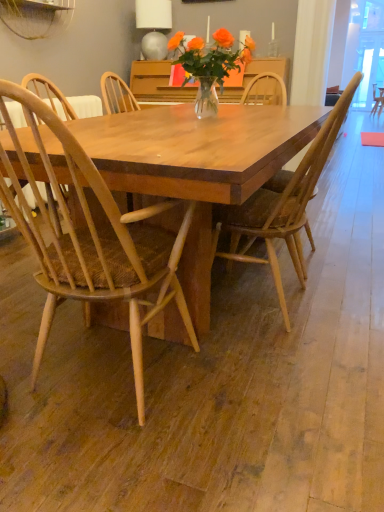
Locate an element on the screen. The width and height of the screenshot is (384, 512). matte gray lampshade at upper center is located at coordinates (154, 26).

Find the location of a particular element. Image resolution: width=384 pixels, height=512 pixels. matte gray lampshade at upper center is located at coordinates (154, 26).

Between matte gray lampshade at upper center and natural wood chair at center, which is the 1th chair in left-to-right order, which one has less height?

With less height is matte gray lampshade at upper center.

From a real-world perspective, is matte gray lampshade at upper center positioned above or below natural wood chair at center, which is the 1th chair in left-to-right order?

Clearly, from a real-world perspective, matte gray lampshade at upper center is above natural wood chair at center, which is the 1th chair in left-to-right order.

Considering the relative sizes of matte gray lampshade at upper center and natural wood chair at center, which is the 1th chair in left-to-right order, in the image provided, is matte gray lampshade at upper center thinner than natural wood chair at center, which is the 1th chair in left-to-right order,?

Indeed, matte gray lampshade at upper center has a lesser width compared to natural wood chair at center, which is the 1th chair in left-to-right order.

Is matte gray lampshade at upper center outside of wooden chair at center, the 2th chair in the left-to-right sequence?

Yes, matte gray lampshade at upper center is located beyond the bounds of wooden chair at center, the 2th chair in the left-to-right sequence.

From the image's perspective, which is below, matte gray lampshade at upper center or wooden chair at center, which is counted as the 1th chair, starting from the right?

wooden chair at center, which is counted as the 1th chair, starting from the right, is shown below in the image.

Which is farther from the camera, (148, 45) or (233, 218)?

Point (148, 45)

How distant is matte gray lampshade at upper center from wooden chair at center, the 2th chair in the left-to-right sequence?

The distance of matte gray lampshade at upper center from wooden chair at center, the 2th chair in the left-to-right sequence, is 8.66 feet.

From the picture: Is wooden chair at center, which is counted as the 1th chair, starting from the right, looking in the opposite direction of matte gray lampshade at upper center?

No.

Which point is more forward, (264,262) or (153,53)?

The point (264,262) is more forward.

Which of these two, wooden chair at center, which is counted as the 1th chair, starting from the right, or matte gray lampshade at upper center, is thinner?

matte gray lampshade at upper center is thinner.

Consider the image. Are wooden chair at center, the 2th chair in the left-to-right sequence, and matte gray lampshade at upper center far apart?

wooden chair at center, the 2th chair in the left-to-right sequence, is positioned a significant distance from matte gray lampshade at upper center.

Where is `chair behind the natural wood chair at center, which is the 1th chair in left-to-right order`? The height and width of the screenshot is (512, 384). chair behind the natural wood chair at center, which is the 1th chair in left-to-right order is located at coordinates (286, 205).

In terms of height, does natural wood chair at center, which is the 1th chair in left-to-right order, look taller or shorter compared to wooden chair at center, the 2th chair in the left-to-right sequence?

Clearly, natural wood chair at center, which is the 1th chair in left-to-right order, is taller compared to wooden chair at center, the 2th chair in the left-to-right sequence.

Is natural wood chair at center, which is the 1th chair in left-to-right order, positioned far away from wooden chair at center, the 2th chair in the left-to-right sequence?

natural wood chair at center, which is the 1th chair in left-to-right order, is actually quite close to wooden chair at center, the 2th chair in the left-to-right sequence.

Is natural wood chair at center, which is counted as the 2th chair, starting from the right, in front of or behind wooden chair at center, which is counted as the 1th chair, starting from the right, in the image?

Clearly, natural wood chair at center, which is counted as the 2th chair, starting from the right, is in front of wooden chair at center, which is counted as the 1th chair, starting from the right.

Which is more to the right, natural wood chair at center, which is the 1th chair in left-to-right order, or matte gray lampshade at upper center?

From the viewer's perspective, natural wood chair at center, which is the 1th chair in left-to-right order, appears more on the right side.

This screenshot has width=384, height=512. Identify the location of lamp lying behind the natural wood chair at center, which is the 1th chair in left-to-right order. (154, 26).

Is natural wood chair at center, which is counted as the 2th chair, starting from the right, positioned in front of matte gray lampshade at upper center?

That is True.

Who is shorter, natural wood chair at center, which is counted as the 2th chair, starting from the right, or matte gray lampshade at upper center?

matte gray lampshade at upper center.

Locate an element on the screen. The height and width of the screenshot is (512, 384). chair on the right of natural wood chair at center, which is counted as the 2th chair, starting from the right is located at coordinates (286, 205).

From the image's perspective, which one is positioned higher, wooden chair at center, which is counted as the 1th chair, starting from the right, or natural wood chair at center, which is counted as the 2th chair, starting from the right?

wooden chair at center, which is counted as the 1th chair, starting from the right, appears higher in the image.

Is wooden chair at center, which is counted as the 1th chair, starting from the right, taller than natural wood chair at center, which is the 1th chair in left-to-right order?

No, wooden chair at center, which is counted as the 1th chair, starting from the right, is not taller than natural wood chair at center, which is the 1th chair in left-to-right order.

Does wooden chair at center, which is counted as the 1th chair, starting from the right, appear on the left side of natural wood chair at center, which is the 1th chair in left-to-right order?

No.

The height and width of the screenshot is (512, 384). Identify the location of lamp behind the natural wood chair at center, which is counted as the 2th chair, starting from the right. (154, 26).

Locate an element on the screen. The height and width of the screenshot is (512, 384). lamp on the left of wooden chair at center, the 2th chair in the left-to-right sequence is located at coordinates (154, 26).

When comparing their distances from matte gray lampshade at upper center, does wooden chair at center, which is counted as the 1th chair, starting from the right, or natural wood chair at center, which is counted as the 2th chair, starting from the right, seem closer?

Among the two, wooden chair at center, which is counted as the 1th chair, starting from the right, is located nearer to matte gray lampshade at upper center.

Based on their spatial positions, is matte gray lampshade at upper center or natural wood chair at center, which is the 1th chair in left-to-right order, further from wooden chair at center, the 2th chair in the left-to-right sequence?

matte gray lampshade at upper center.

Based on their spatial positions, is wooden chair at center, the 2th chair in the left-to-right sequence, or matte gray lampshade at upper center closer to natural wood chair at center, which is the 1th chair in left-to-right order?

wooden chair at center, the 2th chair in the left-to-right sequence, lies closer to natural wood chair at center, which is the 1th chair in left-to-right order, than the other object.

Estimate the real-world distances between objects in this image. Which object is further from natural wood chair at center, which is the 1th chair in left-to-right order, matte gray lampshade at upper center or wooden chair at center, which is counted as the 1th chair, starting from the right?

Among the two, matte gray lampshade at upper center is located further to natural wood chair at center, which is the 1th chair in left-to-right order.

From the image, which object appears to be nearer to wooden chair at center, which is counted as the 1th chair, starting from the right, natural wood chair at center, which is counted as the 2th chair, starting from the right, or matte gray lampshade at upper center?

natural wood chair at center, which is counted as the 2th chair, starting from the right, is closer to wooden chair at center, which is counted as the 1th chair, starting from the right.

Estimate the real-world distances between objects in this image. Which object is further from matte gray lampshade at upper center, natural wood chair at center, which is the 1th chair in left-to-right order, or wooden chair at center, the 2th chair in the left-to-right sequence?

Based on the image, natural wood chair at center, which is the 1th chair in left-to-right order, appears to be further to matte gray lampshade at upper center.

This screenshot has height=512, width=384. I want to click on chair positioned between natural wood chair at center, which is counted as the 2th chair, starting from the right, and matte gray lampshade at upper center from near to far, so click(x=286, y=205).